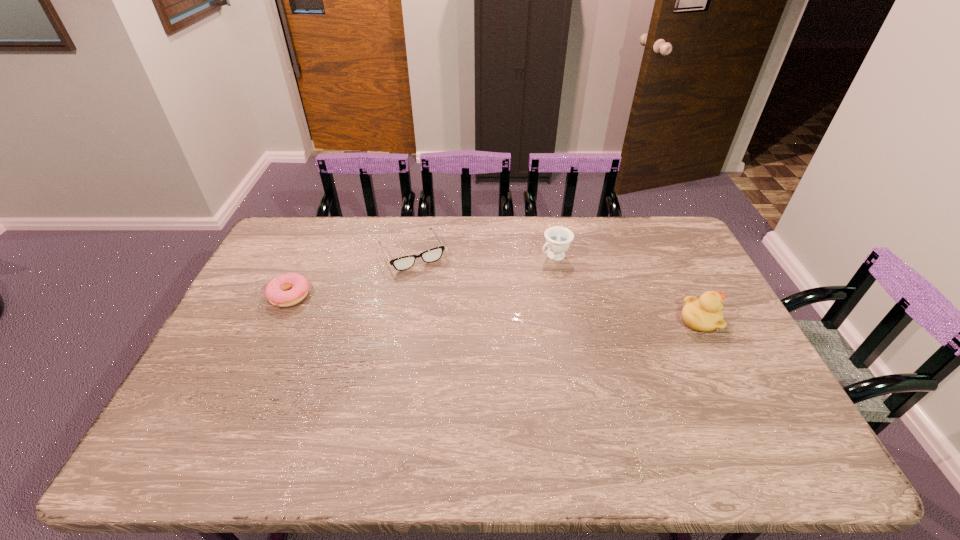
Image resolution: width=960 pixels, height=540 pixels. Identify the location of vacant area located on the side of the teacup with the handle. (477, 306).

Image resolution: width=960 pixels, height=540 pixels. Find the location of `spectacles that is at the far edge`. spectacles that is at the far edge is located at coordinates [402, 263].

You are a GUI agent. You are given a task and a screenshot of the screen. Output one action in this format:
    pyautogui.click(x=<x>, y=<y>)
    Task: Click on the teacup located at the far edge
    
    Given the screenshot: What is the action you would take?
    pyautogui.click(x=558, y=239)

This screenshot has height=540, width=960. In order to click on object that is at the left edge in this screenshot , I will do `click(275, 291)`.

Where is `object at the right edge`? This screenshot has height=540, width=960. object at the right edge is located at coordinates (705, 314).

Image resolution: width=960 pixels, height=540 pixels. In order to click on blank space at the far edge of the desktop in this screenshot , I will do `click(384, 243)`.

Find the location of `vacant space at the near edge`. vacant space at the near edge is located at coordinates (684, 420).

At what (x,y) coordinates should I click in order to perform the action: click on vacant space at the left edge. Please return your answer as a coordinate pair (x, y). Looking at the image, I should click on (247, 314).

Locate an element on the screen. Image resolution: width=960 pixels, height=540 pixels. free region at the right edge of the desktop is located at coordinates (732, 325).

Where is `free space at the far left corner of the desktop`? The height and width of the screenshot is (540, 960). free space at the far left corner of the desktop is located at coordinates (309, 244).